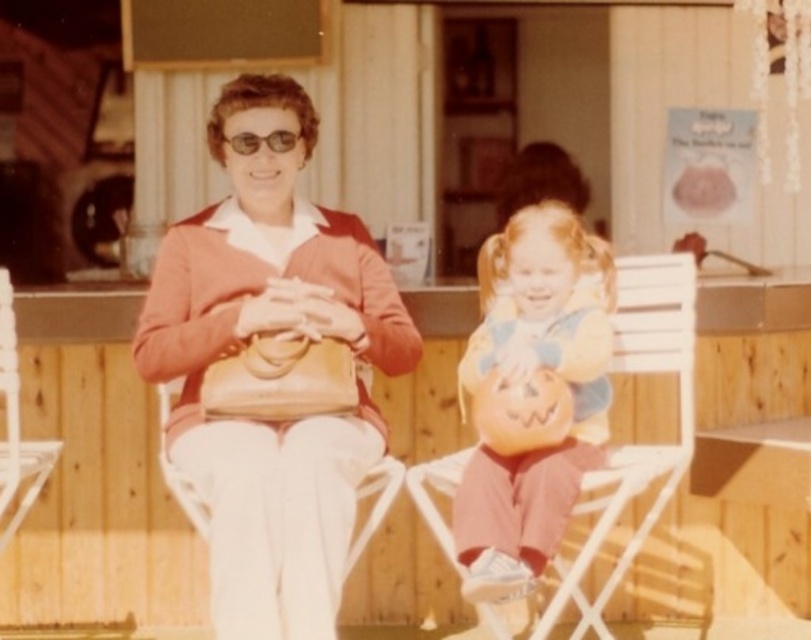
Which is above, matte brown purse at center or matte pumpkin at center?

matte brown purse at center is higher up.

What do you see at coordinates (271, 332) in the screenshot? This screenshot has width=811, height=640. I see `matte brown purse at center` at bounding box center [271, 332].

Which is behind, point (209, 426) or point (458, 554)?

The point (209, 426) is behind.

Locate an element on the screen. matte brown purse at center is located at coordinates (271, 332).

Is point (537, 532) closer to camera compared to point (672, 356)?

Yes, point (537, 532) is closer to viewer.

Find the location of a particular element. The height and width of the screenshot is (640, 811). matte pumpkin at center is located at coordinates tap(524, 378).

Does matte brown purse at center have a greater height compared to white plastic chair at center?

Indeed, matte brown purse at center has a greater height compared to white plastic chair at center.

Is point (298, 156) positioned behind point (432, 481)?

Yes, it is behind point (432, 481).

Between point (185, 452) and point (608, 508), which one is positioned behind?

Point (185, 452)

The height and width of the screenshot is (640, 811). I want to click on matte brown purse at center, so click(271, 332).